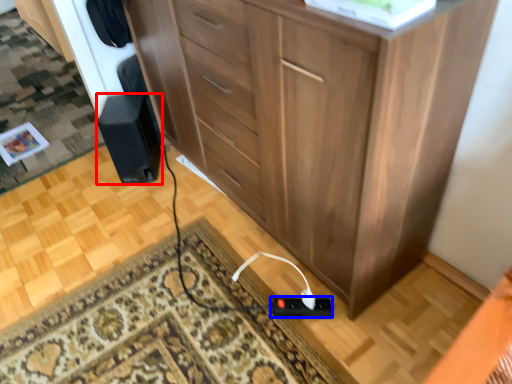
Question: Which of the following is the farthest to the observer, speaker (highlighted by a red box) or plug (highlighted by a blue box)?

Choices:
 (A) speaker
 (B) plug

Answer: (A)